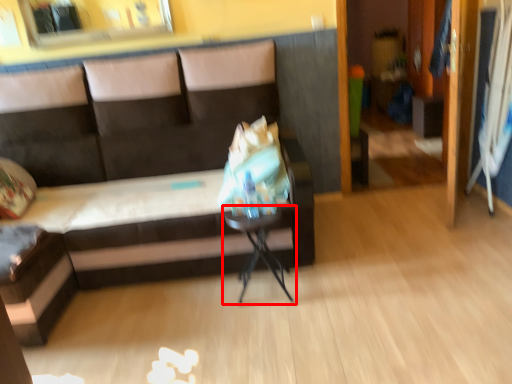
Question: Where is table (annotated by the red box) located in relation to studio couch in the image?

Choices:
 (A) left
 (B) right

Answer: (B)